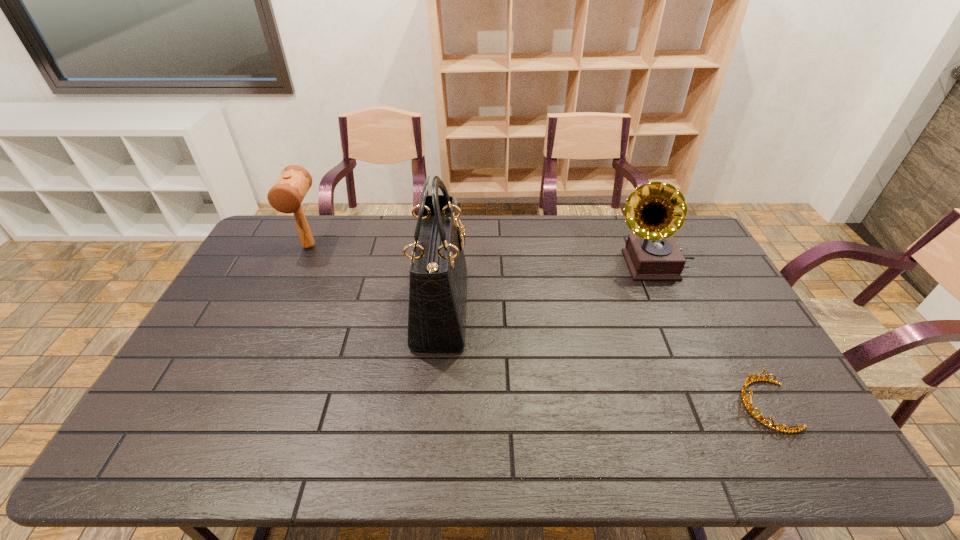
Find the location of a particular element. handbag is located at coordinates pyautogui.click(x=438, y=274).

Identify the location of the tallest object. Image resolution: width=960 pixels, height=540 pixels. (438, 274).

This screenshot has height=540, width=960. Identify the location of phonograph record. (655, 211).

Locate an element on the screen. Image resolution: width=960 pixels, height=540 pixels. the leftmost object is located at coordinates (286, 195).

You are a GUI agent. You are given a task and a screenshot of the screen. Output one action in this format:
    pyautogui.click(x=<x>, y=<y>)
    Task: Click on the shortest object
    
    Given the screenshot: What is the action you would take?
    pyautogui.click(x=748, y=381)

This screenshot has width=960, height=540. Identify the location of the nearest object. (748, 381).

Where is `vacant space located 0.230m at the front of the second object from left to right with visible charms`? This screenshot has height=540, width=960. vacant space located 0.230m at the front of the second object from left to right with visible charms is located at coordinates (540, 309).

Identify the location of vacant position located 0.310m from the horn of the phonograph record. (521, 264).

Find the location of a particular element. vacant region located 0.320m from the horn of the phonograph record is located at coordinates (518, 264).

The image size is (960, 540). Identify the location of blank space located from the horn of the phonograph record. (579, 264).